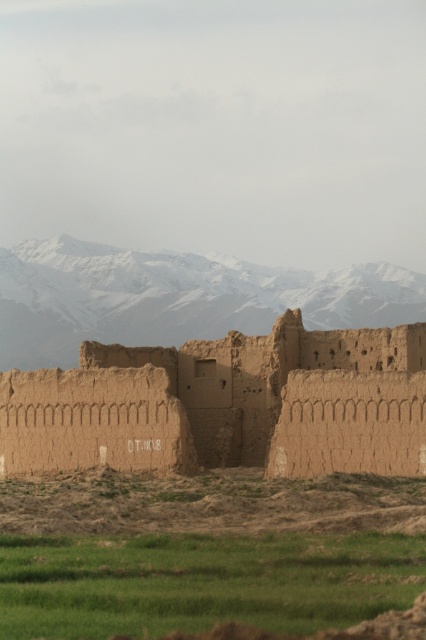
Does brown mudbrick ruins at center have a lesser height compared to snowy rock mountain range at upper center?

Indeed, brown mudbrick ruins at center has a lesser height compared to snowy rock mountain range at upper center.

Based on the photo, how distant is brown mudbrick ruins at center from snowy rock mountain range at upper center?

brown mudbrick ruins at center is 55.23 meters from snowy rock mountain range at upper center.

The width and height of the screenshot is (426, 640). I want to click on brown mudbrick ruins at center, so click(227, 404).

The width and height of the screenshot is (426, 640). Describe the element at coordinates (210, 556) in the screenshot. I see `green grass at lower center` at that location.

Between point (374, 541) and point (135, 353), which one is positioned behind?

The point (135, 353) is behind.

The width and height of the screenshot is (426, 640). I want to click on green grass at lower center, so click(210, 556).

Which is in front, point (333, 624) or point (406, 273)?

Point (333, 624) is in front.

Is point (209, 600) positioned before point (5, 368)?

Yes, it is in front of point (5, 368).

This screenshot has height=640, width=426. I want to click on green grass at lower center, so click(x=210, y=556).